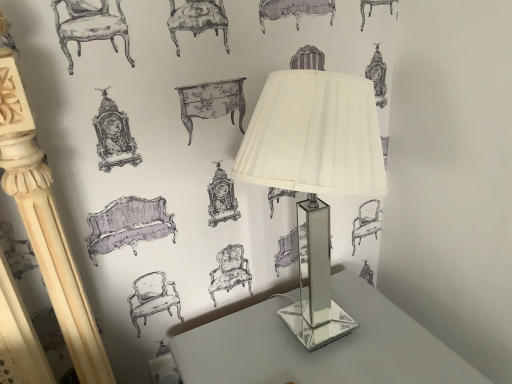
Where is `free space above clear glass table at center (from a real-world perspective)`? free space above clear glass table at center (from a real-world perspective) is located at coordinates (317, 341).